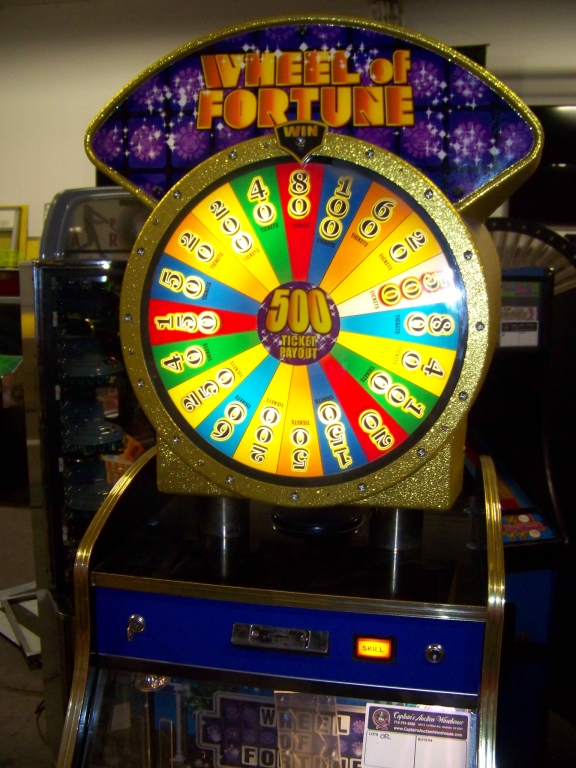
You are a GUI agent. You are given a task and a screenshot of the screen. Output one action in this format:
    pyautogui.click(x=<x>, y=<y>)
    Task: Click on the screen
    The height and width of the screenshot is (768, 576).
    Given the screenshot: What is the action you would take?
    pyautogui.click(x=556, y=163)